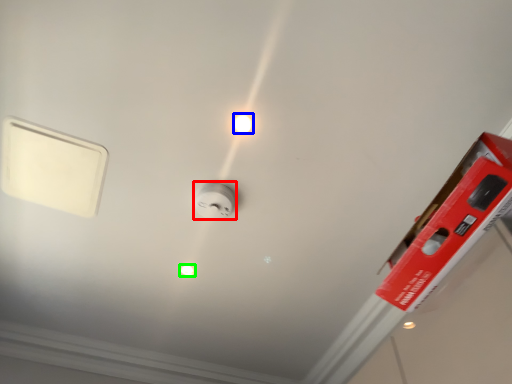
Question: Considering the real-world distances, which object is closest to power plugs and sockets (highlighted by a red box)? light bulb (highlighted by a blue box) or light bulb (highlighted by a green box).

Choices:
 (A) light bulb
 (B) light bulb

Answer: (A)